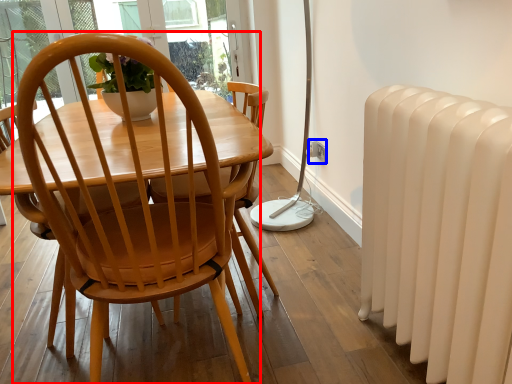
Question: Which object appears farthest to the camera in this image, chair (highlighted by a red box) or power outlet (highlighted by a blue box)?

Choices:
 (A) chair
 (B) power outlet

Answer: (B)